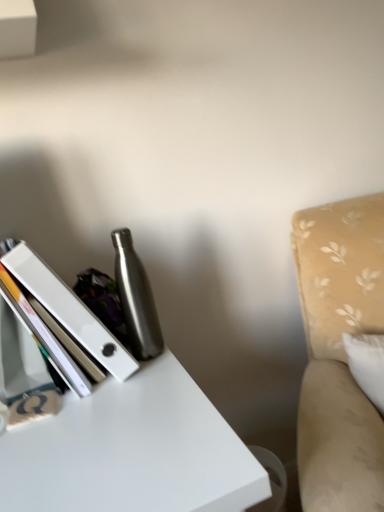
Question: Do you think brushed metal water bottle at center is within white glossy book at left, or outside of it?

Choices:
 (A) outside
 (B) inside

Answer: (A)

Question: Would you say brushed metal water bottle at center is to the left or to the right of white glossy book at left in the picture?

Choices:
 (A) right
 (B) left

Answer: (A)

Question: Estimate the real-world distances between objects in this image. Which object is farther from the brushed metal water bottle at center?

Choices:
 (A) beige fabric swivel chair at right
 (B) white glossy book at left

Answer: (A)

Question: Which of these objects is positioned closest to the brushed metal water bottle at center?

Choices:
 (A) beige fabric swivel chair at right
 (B) white glossy book at left

Answer: (B)